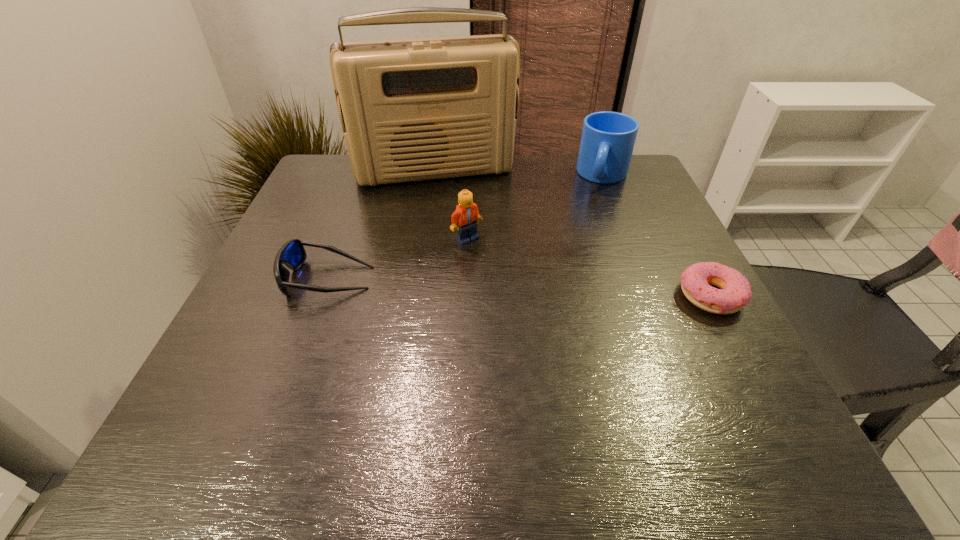
In order to click on free space located 0.170m on the side of the mug with the handle in this screenshot , I will do `click(591, 231)`.

At what (x,y) coordinates should I click in order to perform the action: click on blank area located on the side of the mug with the handle. Please return your answer as a coordinate pair (x, y). This screenshot has width=960, height=540. Looking at the image, I should click on (593, 223).

In order to click on free region located on the front-facing side of the Lego in this screenshot , I will do `click(616, 309)`.

Image resolution: width=960 pixels, height=540 pixels. Identify the location of free space located on the front-facing side of the Lego. (602, 302).

Where is `vacant space located on the front-facing side of the Lego`? This screenshot has height=540, width=960. vacant space located on the front-facing side of the Lego is located at coordinates (627, 314).

The width and height of the screenshot is (960, 540). Identify the location of radio receiver at the far edge. (419, 109).

Identify the location of mug at the far edge. (608, 138).

Find the location of a particular element. Image resolution: width=960 pixels, height=540 pixels. sunglasses that is at the left edge is located at coordinates (292, 254).

Where is `radio receiver that is at the left edge`? The width and height of the screenshot is (960, 540). radio receiver that is at the left edge is located at coordinates (x=419, y=109).

In order to click on doughnut that is at the right edge in this screenshot , I will do `click(735, 292)`.